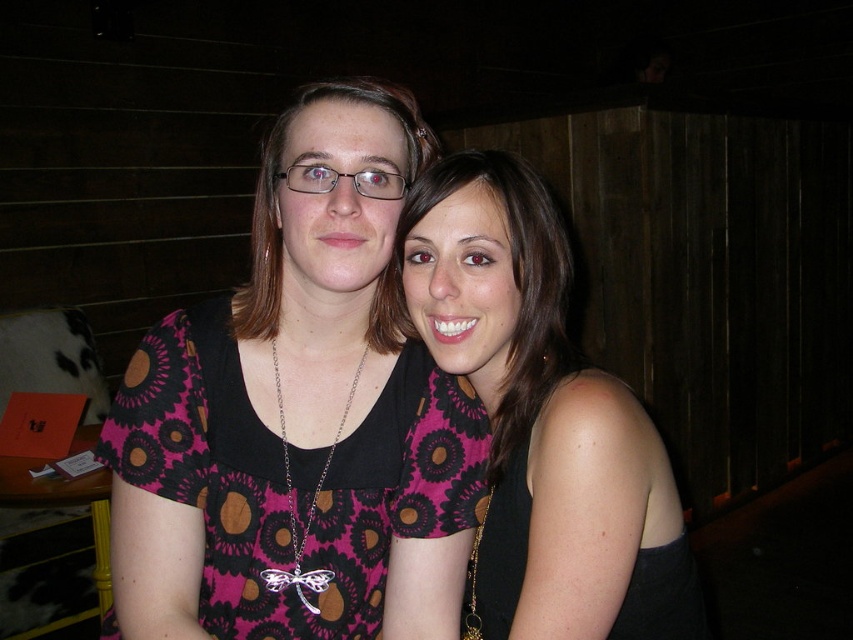
You are a photographer setting up for a group photo. You need to position two models wearing the pink printed fabric dress at center and the black matte dress at right. According to the scene, which dress is positioned closer to the left side of the frame?

The pink printed fabric dress at center is positioned to the left of the black matte dress at right, so the pink printed fabric dress at center is closer to the left side of the frame.

You are standing in the room where the two people are posing. You want to move to the point marked at coordinates (x=454, y=276). If your height is 68 inches, can you comfortably reach that point without stretching?

The point at coordinates (x=454, y=276) is 31.28 inches away from you. Since the average comfortable reaching distance for a person of 68 inches tall is about 24 to 30 inches, you would need to stretch slightly to reach it.

Based on the photo, you are a photographer setting up for a photoshoot in a dimly lit wooden interior. You have two dresses to feature, the pink floral dress at center and the black matte dress at right. The client wants to know which dress will cast a bigger shadow. Based on the scene description, which dress will have a larger shadow?

The pink floral dress at center has a larger size compared to the black matte dress at right, so it will cast a bigger shadow.